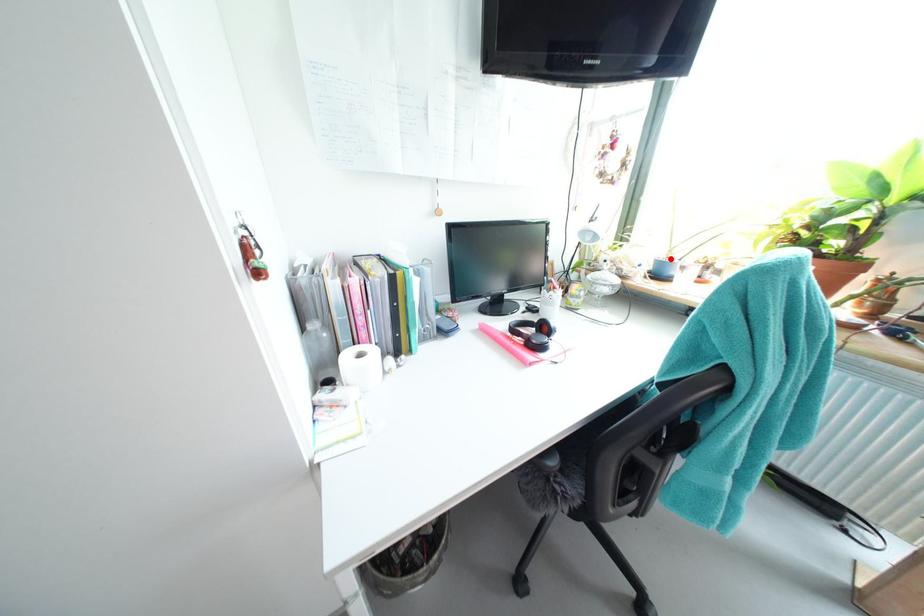
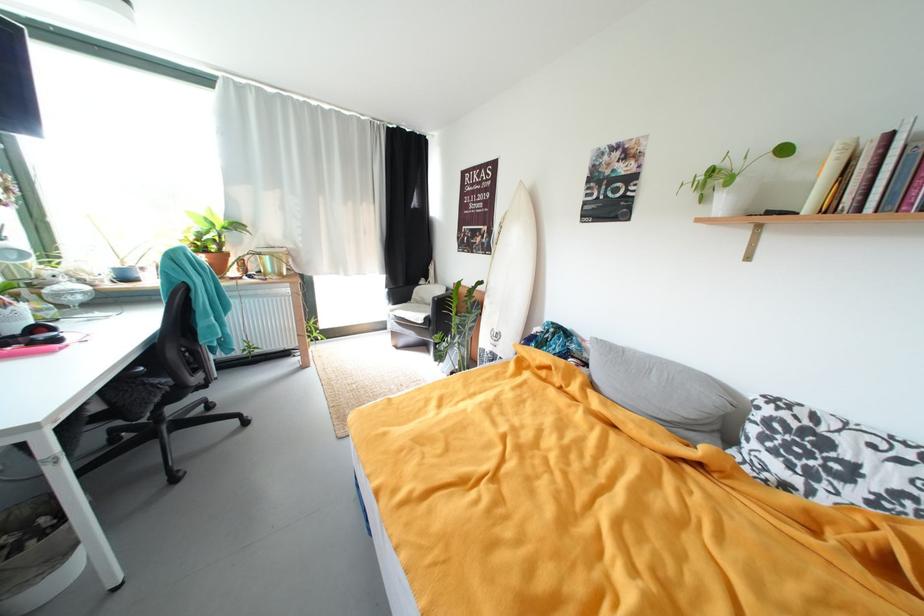
Where in the second image is the point corresponding to the highlighted location from the first image?

(127, 268)